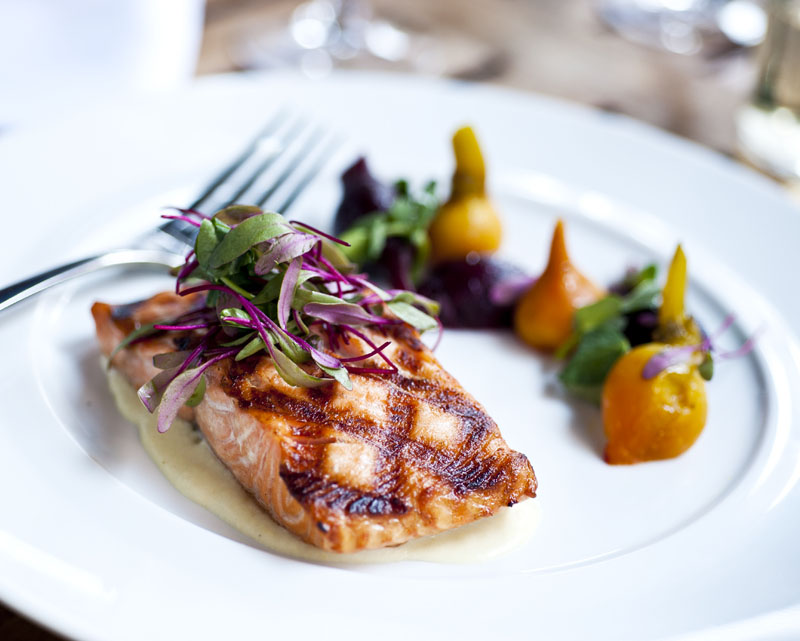
You are a GUI agent. You are given a task and a screenshot of the screen. Output one action in this format:
    pyautogui.click(x=<x>, y=<y>)
    Task: Click on the glass
    The image size is (800, 641).
    Given the screenshot: What is the action you would take?
    pyautogui.click(x=342, y=29)